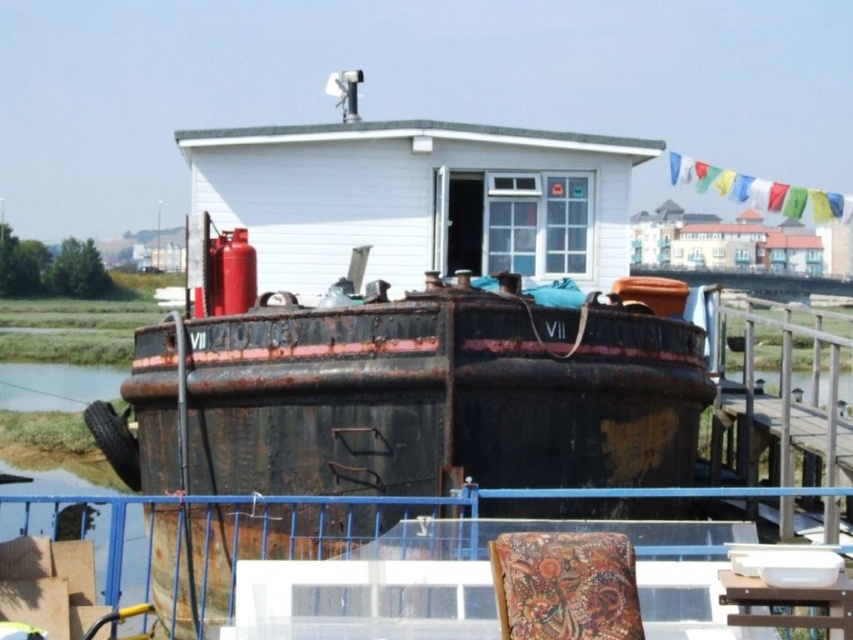
You are planning to host a small gathering on the houseboat and want to seat guests comfortably. Given the space available, which object from the patterned fabric chair at lower center and the wooden table at lower right would allow more guests to sit comfortably?

The patterned fabric chair at lower center is bigger than the wooden table at lower right, so it can accommodate more guests comfortably.

You are standing on the deck of the houseboat and want to move from the wooden table at lower right to the patterned fabric chair at lower center. Which direction should you move to reach it?

You should move to the left to reach the patterned fabric chair at lower center because it is located to the left of the wooden table at lower right.

You are standing on the deck of the houseboat and want to place a new potted plant exactly at the center of the deck. The deck is a rectangular area. The patterned fabric chair at lower center is located at coordinate point 0.916, 0.664. Where should you place the potted plant to ensure it is centered?

The deck is rectangular, so the center would be at the midpoint between its length and width. Since the patterned fabric chair at lower center is at (566,586), the center of the deck should be calculated by averaging the coordinates if the chair is at a corner or known position. However, without specific deck dimensions, the exact center can be estimated by positioning the potted plant at the coordinate point (426,320), which is the mathematical center of a normalized coordinate system.